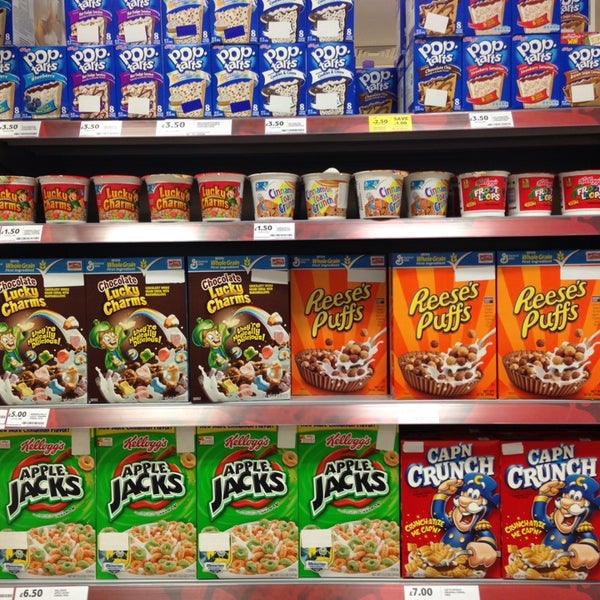
Locate an element on the screen. This screenshot has height=600, width=600. cereals on second lowest row is located at coordinates (42, 338), (145, 316), (217, 324), (322, 326), (474, 339), (537, 342).